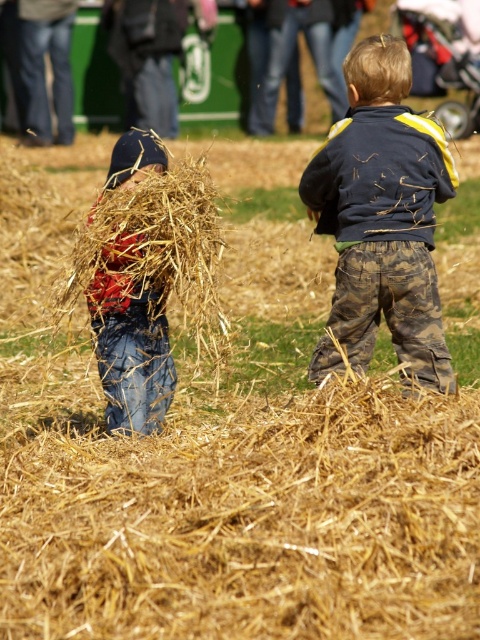
You are a photographer trying to capture both the camouflage pants at center and the denim jeans at left in a single shot. Since the camera can only focus on one object at a time, which object should you choose to ensure the other remains visible in the background?

Since the camouflage pants at center is bigger than denim jeans at left, you should focus on the camouflage pants at center to ensure the denim jeans at left stays visible in the background.

You are a photographer trying to capture both the camouflage pants at center and the denim jeans at left in a single shot. Which clothing item will appear closer to the camera in your photo?

The camouflage pants at center will appear closer to the camera because it is positioned closer to the viewer compared to the denim jeans at left.

You are a photographer trying to capture a photo of the camouflage pants at center and denim jeans at left. Based on their positions, which one is closer to the camera?

The camouflage pants at center is located above denim jeans at left, so the camouflage pants at center is closer to the camera.